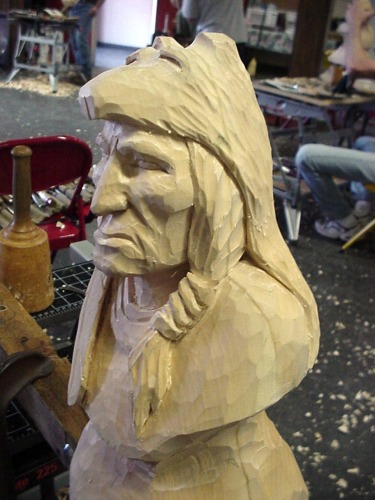
Find the location of a particular element. This screenshot has width=375, height=500. white door is located at coordinates (133, 9).